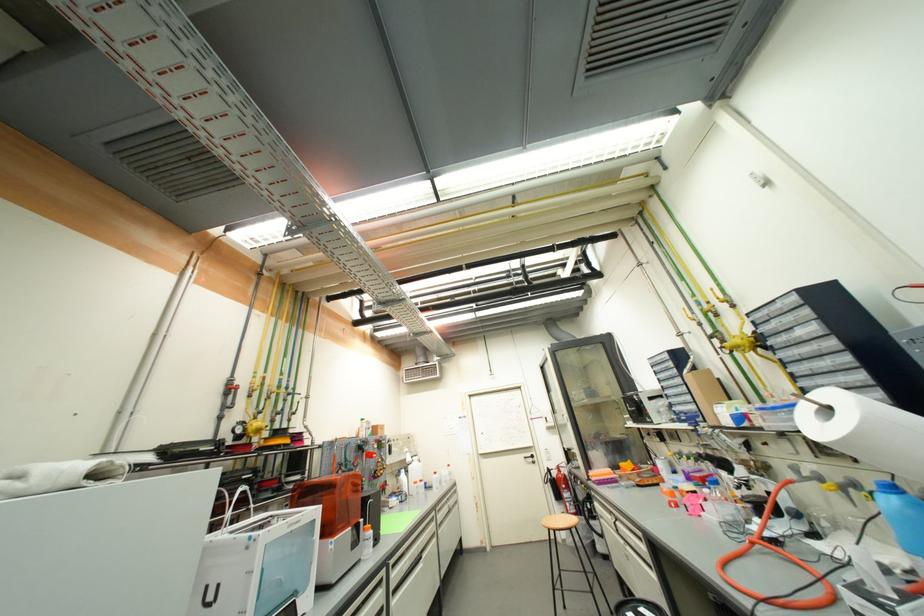
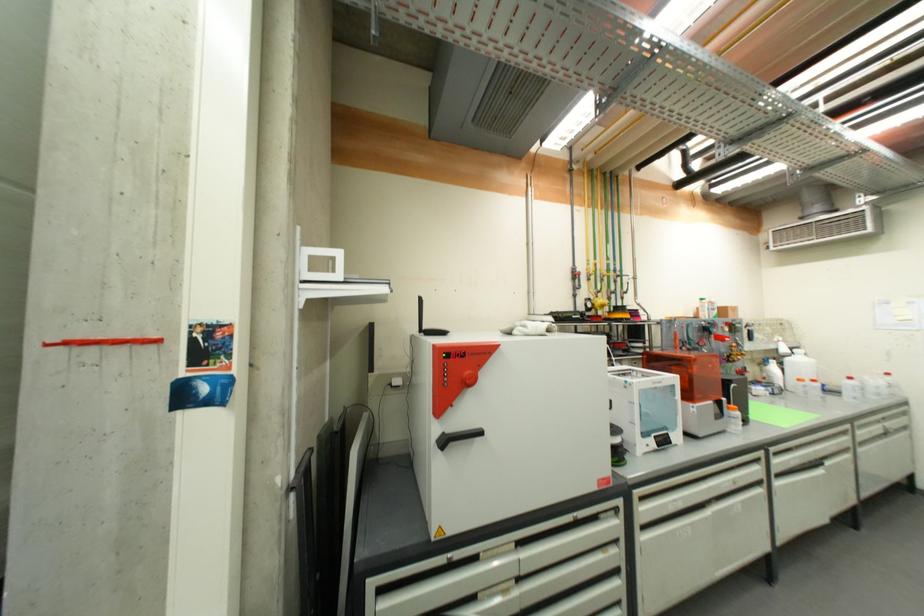
Find the pixel in the second image that matches [373,532] in the first image.

(739, 411)